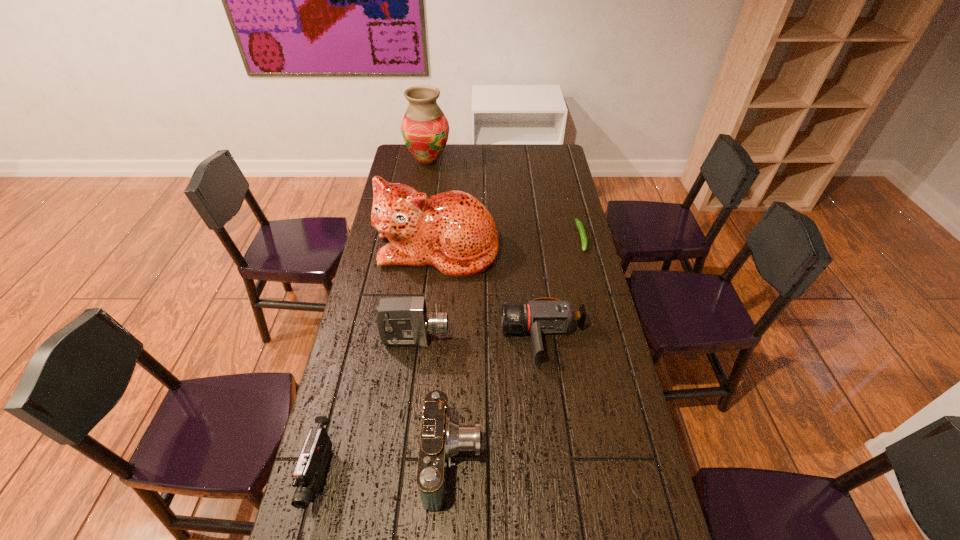
The height and width of the screenshot is (540, 960). Find the location of `vacant area located 0.250m on the face of the cat`. vacant area located 0.250m on the face of the cat is located at coordinates [429, 333].

Locate an element on the screen. Image resolution: width=960 pixels, height=540 pixels. vacant space situated 0.130m at the front of the tallest camcorder, highlighting the lens is located at coordinates (489, 339).

Identify the location of blank area located 0.290m on the lens of the shortest camcorder. The height and width of the screenshot is (540, 960). (414, 338).

I want to click on free space located 0.170m on the lens of the shortest camcorder, so click(x=450, y=338).

This screenshot has height=540, width=960. What are the coordinates of `vacant space located 0.310m on the lens of the shortest camcorder` in the screenshot? It's located at (407, 338).

I want to click on vacant space located on the front-facing side of the zucchini, so click(588, 262).

Where is `object that is at the far edge`? object that is at the far edge is located at coordinates (425, 129).

Find the location of `vase positioned at the left edge`. vase positioned at the left edge is located at coordinates click(425, 129).

The width and height of the screenshot is (960, 540). Identify the location of cat present at the left edge. (453, 231).

At what (x,y) coordinates should I click in order to perform the action: click on camcorder that is at the right edge. Please return your answer as a coordinate pair (x, y). Image resolution: width=960 pixels, height=540 pixels. Looking at the image, I should click on (540, 316).